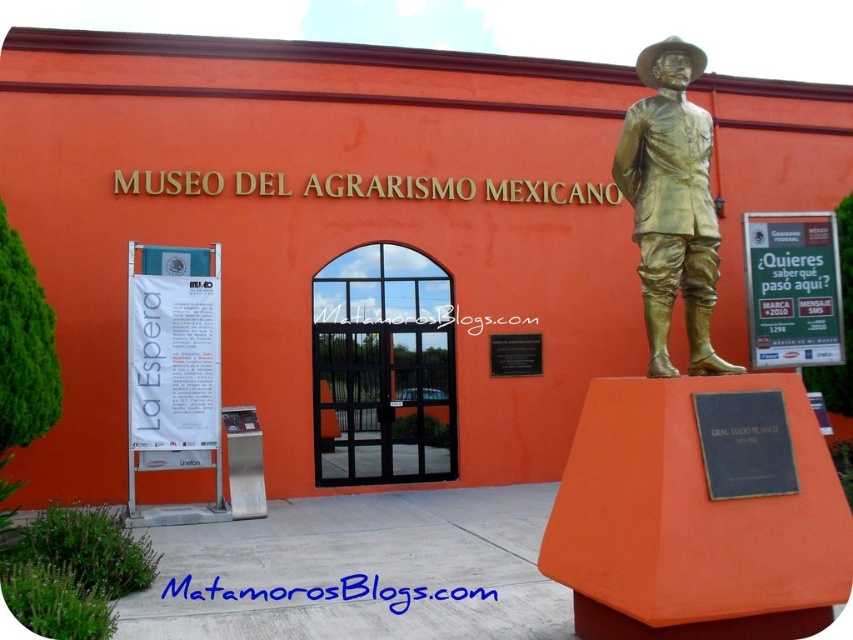
Question: Which object appears farthest from the camera in this image?

Choices:
 (A) bronze statue at right
 (B) black polished stone plaque at center

Answer: (B)

Question: Where is bronze statue at right located in relation to black polished stone plaque at center in the image?

Choices:
 (A) left
 (B) right

Answer: (B)

Question: Can you confirm if black glass door at center is positioned to the left of black leather plaque at center?

Choices:
 (A) no
 (B) yes

Answer: (B)

Question: Is the position of black glass door at center less distant than that of black polished stone plaque at center?

Choices:
 (A) yes
 (B) no

Answer: (A)

Question: Which object appears closest to the camera in this image?

Choices:
 (A) black leather plaque at center
 (B) bronze statue at right
 (C) black glass door at center

Answer: (A)

Question: Among these points, which one is nearest to the camera?

Choices:
 (A) (492, 337)
 (B) (440, 403)
 (C) (695, 339)
 (D) (746, 428)

Answer: (D)